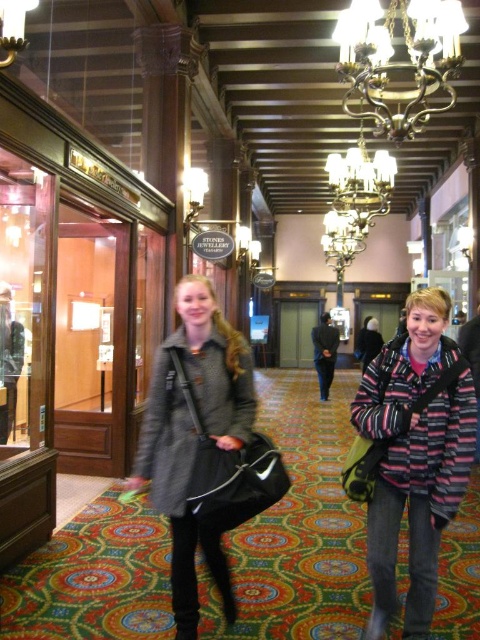
Question: Which object appears farthest from the camera in this image?

Choices:
 (A) gray wool coat at center
 (B) striped woolen sweater at center
 (C) bronze metallic chandelier at upper center

Answer: (C)

Question: Can you confirm if striped woolen sweater at center is positioned above gray wool coat at center?

Choices:
 (A) no
 (B) yes

Answer: (A)

Question: Among these objects, which one is farthest from the camera?

Choices:
 (A) gray wool coat at center
 (B) bronze metallic chandelier at upper center
 (C) striped woolen sweater at center

Answer: (B)

Question: Does gray wool coat at center have a greater width compared to bronze metallic chandelier at upper center?

Choices:
 (A) yes
 (B) no

Answer: (B)

Question: Is gray wool coat at center thinner than bronze metallic chandelier at upper center?

Choices:
 (A) yes
 (B) no

Answer: (A)

Question: Which point is farther to the camera?

Choices:
 (A) (427, 305)
 (B) (181, 566)

Answer: (B)